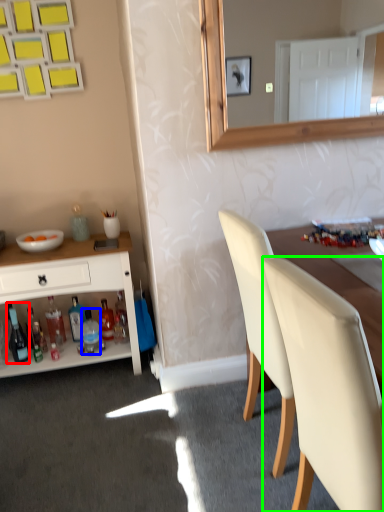
Question: Based on their relative distances, which object is nearer to bottle (highlighted by a red box)? Choose from bottle (highlighted by a blue box) and chair (highlighted by a green box).

Choices:
 (A) bottle
 (B) chair

Answer: (A)